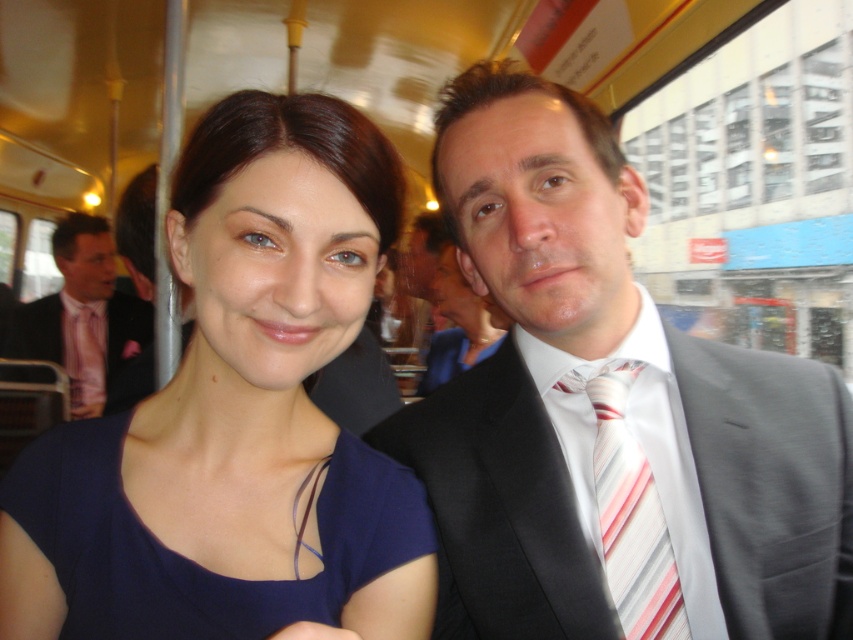
Does navy blue fabric dress at center have a lesser height compared to striped silk tie at right?

Yes.

Image resolution: width=853 pixels, height=640 pixels. Describe the element at coordinates (190, 561) in the screenshot. I see `navy blue fabric dress at center` at that location.

You are a GUI agent. You are given a task and a screenshot of the screen. Output one action in this format:
    pyautogui.click(x=<x>, y=<y>)
    Task: Click on the navy blue fabric dress at center
    The width and height of the screenshot is (853, 640).
    Given the screenshot: What is the action you would take?
    (190, 561)

Does point (370, 554) come farther from viewer compared to point (149, 324)?

No, (370, 554) is closer to viewer.

Between navy blue fabric dress at center and pink striped tie at left, which one appears on the left side from the viewer's perspective?

From the viewer's perspective, pink striped tie at left appears more on the left side.

Identify the location of navy blue fabric dress at center. (190, 561).

Does striped silk tie at right have a smaller size compared to pink striped tie at left?

Indeed, striped silk tie at right has a smaller size compared to pink striped tie at left.

Is striped silk tie at right positioned at the back of pink striped tie at left?

No, it is in front of pink striped tie at left.

Who is more distant from viewer, (660, 531) or (106, 320)?

The point (106, 320) is more distant.

Identify the location of striped silk tie at right. This screenshot has width=853, height=640. (630, 512).